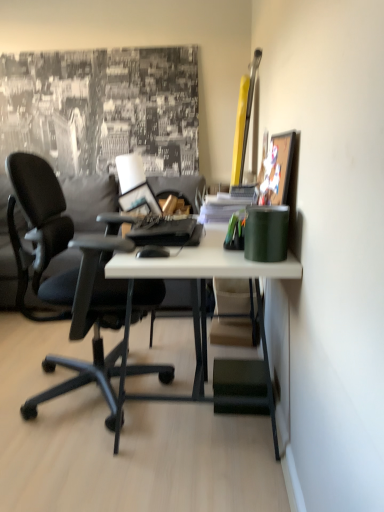
Describe the element at coordinates (266, 233) in the screenshot. I see `green matte cup at right, which is the 2th stationery in back-to-front order` at that location.

The height and width of the screenshot is (512, 384). Find the location of `white matte desk at center`. white matte desk at center is located at coordinates (201, 303).

This screenshot has height=512, width=384. Describe the element at coordinates (89, 200) in the screenshot. I see `gray fabric pillow at left` at that location.

The image size is (384, 512). Describe the element at coordinates (277, 169) in the screenshot. I see `wooden picture frame at upper right` at that location.

Locate an element on the screen. The width and height of the screenshot is (384, 512). wooden picture frame at upper right is located at coordinates (277, 169).

Find the location of a particular element. Image resolution: width=384 pixels, height=512 pixels. green plastic pen holder at center, which ranks as the second stationery in front-to-back order is located at coordinates (235, 231).

Considering the positions of point (236, 247) and point (293, 139), is point (236, 247) closer or farther from the camera than point (293, 139)?

Point (236, 247) appears to be farther away from the viewer than point (293, 139).

From the picture: Is green plastic pen holder at center, the first stationery when ordered from back to front, thinner than wooden picture frame at upper right?

No, green plastic pen holder at center, the first stationery when ordered from back to front, is not thinner than wooden picture frame at upper right.

Is green plastic pen holder at center, the first stationery when ordered from back to front, in contact with wooden picture frame at upper right?

No, green plastic pen holder at center, the first stationery when ordered from back to front, is not beside wooden picture frame at upper right.

From a real-world perspective, who is located higher, green plastic pen holder at center, which ranks as the second stationery in front-to-back order, or wooden picture frame at upper right?

In real-world perspective, wooden picture frame at upper right is above.

Can you tell me how much black matte mouse at center and white matte desk at center differ in facing direction?

They differ by 4.7 degrees in their facing directions.

From the image's perspective, is black matte mouse at center positioned above or below white matte desk at center?

Clearly, from the image's perspective, black matte mouse at center is above white matte desk at center.

Which is correct: black matte mouse at center is inside white matte desk at center, or outside of it?

black matte mouse at center lies outside white matte desk at center.

Which object is further away from the camera taking this photo, black matte mouse at center or white matte desk at center?

black matte mouse at center is behind.

Who is taller, green plastic pen holder at center, the first stationery when ordered from back to front, or green matte cup at right, placed as the first stationery when sorted from front to back?

green matte cup at right, placed as the first stationery when sorted from front to back, is taller.

Would you say green matte cup at right, placed as the first stationery when sorted from front to back, is part of green plastic pen holder at center, which ranks as the second stationery in front-to-back order,'s contents?

No, green matte cup at right, placed as the first stationery when sorted from front to back, is located outside of green plastic pen holder at center, which ranks as the second stationery in front-to-back order.

Can you confirm if green plastic pen holder at center, which ranks as the second stationery in front-to-back order, is positioned to the left of green matte cup at right, which is the 2th stationery in back-to-front order?

Indeed, green plastic pen holder at center, which ranks as the second stationery in front-to-back order, is positioned on the left side of green matte cup at right, which is the 2th stationery in back-to-front order.

How much distance is there between green matte cup at right, which is the 2th stationery in back-to-front order, and satin black laptop at center?

The distance of green matte cup at right, which is the 2th stationery in back-to-front order, from satin black laptop at center is 1.30 meters.

The width and height of the screenshot is (384, 512). Identify the location of the 2nd stationery to the right of the satin black laptop at center, counting from the anchor's position. (266, 233).

From the image's perspective, is green matte cup at right, placed as the first stationery when sorted from front to back, above satin black laptop at center?

Actually, green matte cup at right, placed as the first stationery when sorted from front to back, appears below satin black laptop at center in the image.

Can satin black laptop at center be found inside green matte cup at right, placed as the first stationery when sorted from front to back?

Actually, satin black laptop at center is outside green matte cup at right, placed as the first stationery when sorted from front to back.

Consider the image. From a real-world perspective, is gray fabric pillow at left physically below wooden picture frame at upper right?

Correct, in the physical world, gray fabric pillow at left is lower than wooden picture frame at upper right.

From the image's perspective, is gray fabric pillow at left above or below wooden picture frame at upper right?

gray fabric pillow at left is situated lower than wooden picture frame at upper right in the image.

How many degrees apart are the facing directions of gray fabric pillow at left and wooden picture frame at upper right?

There is a 90.6-degree angle between the facing directions of gray fabric pillow at left and wooden picture frame at upper right.

Consider the image. Which object is further away from the camera, gray fabric pillow at left or wooden picture frame at upper right?

gray fabric pillow at left is further from the camera.

Measure the distance from satin black laptop at center to green plastic pen holder at center, which ranks as the second stationery in front-to-back order.

satin black laptop at center and green plastic pen holder at center, which ranks as the second stationery in front-to-back order, are 38.38 inches apart from each other.

Based on the photo, is the surface of satin black laptop at center in direct contact with green plastic pen holder at center, the first stationery when ordered from back to front?

They are not placed beside each other.

Which is in front, satin black laptop at center or green plastic pen holder at center, the first stationery when ordered from back to front?

green plastic pen holder at center, the first stationery when ordered from back to front, is closer to the camera.

In terms of height, does satin black laptop at center look taller or shorter compared to green plastic pen holder at center, which ranks as the second stationery in front-to-back order?

Considering their sizes, satin black laptop at center has less height than green plastic pen holder at center, which ranks as the second stationery in front-to-back order.

Is gray fabric pillow at left next to white matte desk at center and touching it?

gray fabric pillow at left and white matte desk at center are not in contact.

Is gray fabric pillow at left inside the boundaries of white matte desk at center, or outside?

gray fabric pillow at left is spatially situated outside white matte desk at center.

Find the location of a particular element. The image size is (384, 512). stationery that is the 2nd one when counting leftward from the wooden picture frame at upper right is located at coordinates (235, 231).

The width and height of the screenshot is (384, 512). I want to click on desk located below the black matte mouse at center (from the image's perspective), so click(201, 303).

Consider the image. Which object lies nearer to the anchor point green matte cup at right, which is the 2th stationery in back-to-front order, wooden picture frame at upper right or black matte mouse at center?

wooden picture frame at upper right is positioned closer to the anchor green matte cup at right, which is the 2th stationery in back-to-front order.

Estimate the real-world distances between objects in this image. Which object is further from wooden picture frame at upper right, green plastic pen holder at center, which ranks as the second stationery in front-to-back order, or satin black laptop at center?

satin black laptop at center lies further to wooden picture frame at upper right than the other object.

Looking at the image, which one is located further to green plastic pen holder at center, which ranks as the second stationery in front-to-back order, white matte desk at center or gray fabric pillow at left?

gray fabric pillow at left is positioned further to the anchor green plastic pen holder at center, which ranks as the second stationery in front-to-back order.

Based on their spatial positions, is white matte desk at center or green matte cup at right, which is the 2th stationery in back-to-front order, closer to black matte mouse at center?

white matte desk at center lies closer to black matte mouse at center than the other object.

Considering their positions, is wooden picture frame at upper right positioned closer to white matte desk at center than gray fabric pillow at left?

Based on the image, wooden picture frame at upper right appears to be nearer to white matte desk at center.

From the image, which object appears to be farther from satin black laptop at center, green matte cup at right, placed as the first stationery when sorted from front to back, or wooden picture frame at upper right?

green matte cup at right, placed as the first stationery when sorted from front to back, lies further to satin black laptop at center than the other object.

Estimate the real-world distances between objects in this image. Which object is further from gray fabric pillow at left, wooden picture frame at upper right or black matte mouse at center?

The object further to gray fabric pillow at left is wooden picture frame at upper right.

Based on their spatial positions, is green plastic pen holder at center, which ranks as the second stationery in front-to-back order, or green matte cup at right, placed as the first stationery when sorted from front to back, closer to white matte desk at center?

A: green matte cup at right, placed as the first stationery when sorted from front to back.

The image size is (384, 512). Identify the location of mouse between green matte cup at right, placed as the first stationery when sorted from front to back, and gray fabric pillow at left in the front-back direction. (152, 252).

Locate an element on the screen. This screenshot has height=512, width=384. laptop positioned between green plastic pen holder at center, the first stationery when ordered from back to front, and gray fabric pillow at left from near to far is located at coordinates (147, 205).

Locate an element on the screen. stationery between black matte mouse at center and gray fabric pillow at left from front to back is located at coordinates (235, 231).

At what (x,y) coordinates should I click in order to perform the action: click on laptop situated between black matte mouse at center and green plastic pen holder at center, which ranks as the second stationery in front-to-back order, from left to right. Please return your answer as a coordinate pair (x, y). The width and height of the screenshot is (384, 512). Looking at the image, I should click on (147, 205).